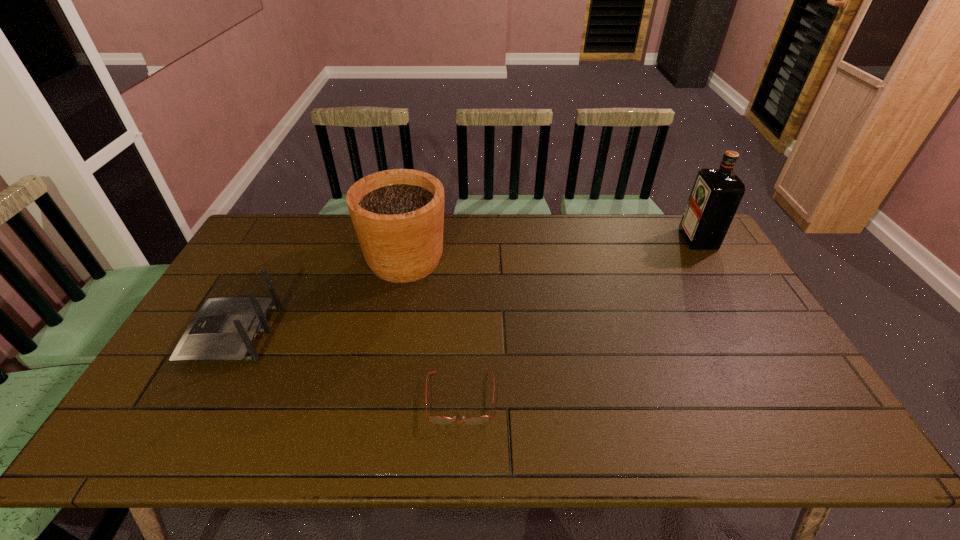
You are a GUI agent. You are given a task and a screenshot of the screen. Output one action in this format:
    pyautogui.click(x=<x>, y=<y>)
    Task: Click on the free space between the tallest object and the third tallest object
    This screenshot has height=540, width=960.
    Given the screenshot: What is the action you would take?
    pyautogui.click(x=466, y=287)

Where is `empty space between the second nearest object and the nearest object`? empty space between the second nearest object and the nearest object is located at coordinates (347, 366).

Find the location of a particular element. The width and height of the screenshot is (960, 540). object that is the second closest to the third shortest object is located at coordinates (436, 419).

Select which object is the third closest to the rightmost object. Please provide its 2D coordinates. Your answer should be formatted as a tuple, i.e. [(x, y)], where the tuple contains the x and y coordinates of a point satisfying the conditions above.

[(225, 329)]

Image resolution: width=960 pixels, height=540 pixels. Find the location of `vacant space that satisfies the following two spatial constraints: 1. on the front label of the liquor; 2. on the lenses of the spectacles`. vacant space that satisfies the following two spatial constraints: 1. on the front label of the liquor; 2. on the lenses of the spectacles is located at coordinates (795, 398).